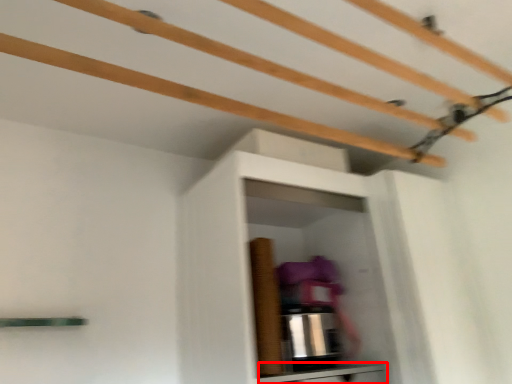
Question: In this image, where is cabinetry (annotated by the red box) located relative to shelf?

Choices:
 (A) right
 (B) left

Answer: (A)